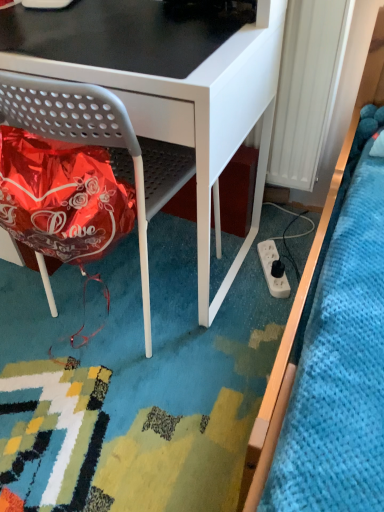
I want to click on blank space to the left of white plastic power plugs and sockets at lower right, so click(x=233, y=275).